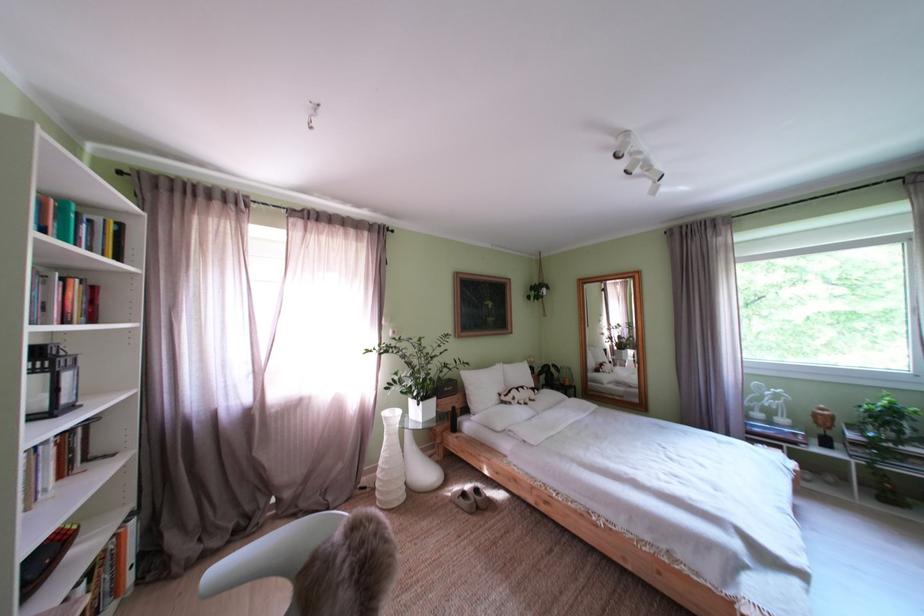
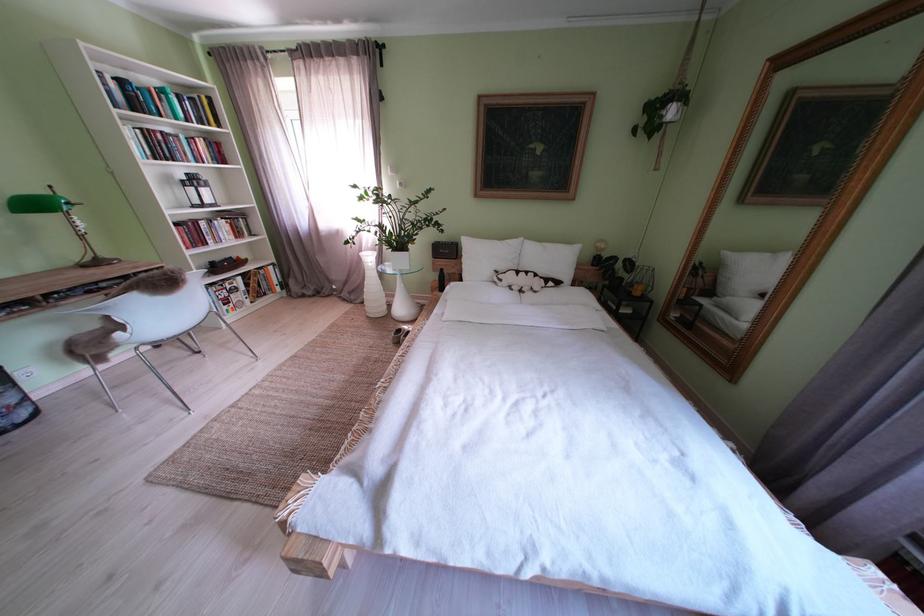
The point at (578,389) is marked in the first image. Where is the corresponding point in the second image?

(648, 299)